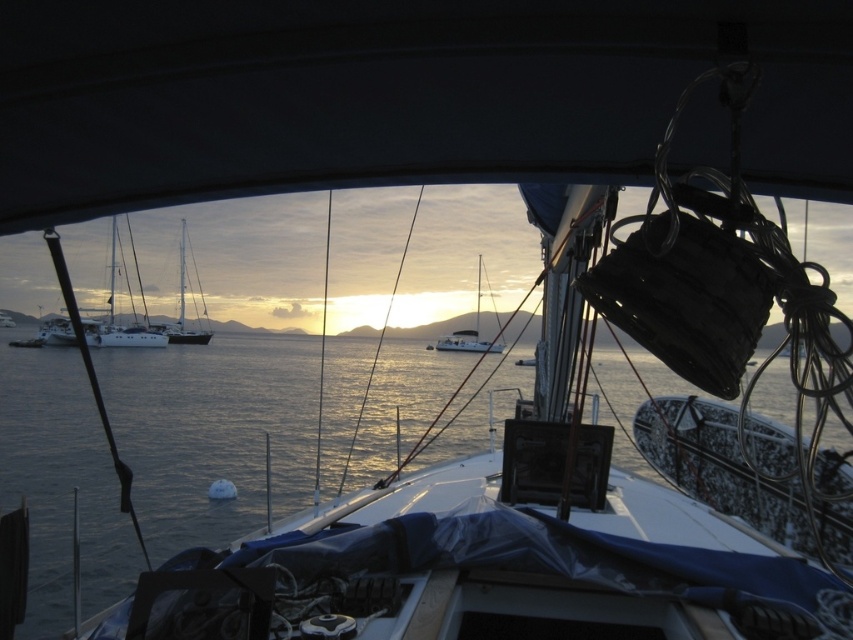
Question: Is white glossy sailboat at center positioned at the back of white glossy sailboat at left?

Choices:
 (A) no
 (B) yes

Answer: (B)

Question: Is white matte sailboat at left below white glossy sailboat at left?

Choices:
 (A) yes
 (B) no

Answer: (B)

Question: Which point is farther to the camera?

Choices:
 (A) (418, 620)
 (B) (471, 346)

Answer: (B)

Question: Which object is the farthest from the white glossy sailboat at left?

Choices:
 (A) white matte sailboat at center
 (B) glistening silver water at center

Answer: (B)

Question: Can you confirm if white matte sailboat at center is positioned to the left of white glossy sailboat at left?

Choices:
 (A) no
 (B) yes

Answer: (A)

Question: Which point is closer to the camera?

Choices:
 (A) (42, 342)
 (B) (428, 628)

Answer: (B)